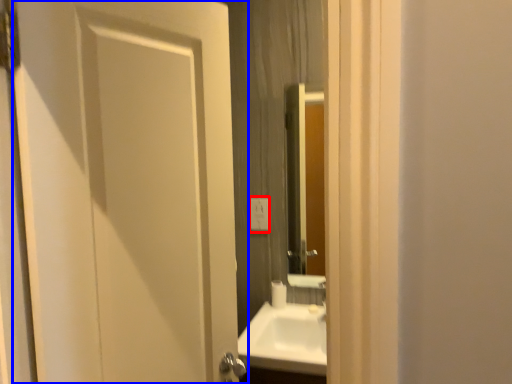
Question: Among these objects, which one is farthest to the camera, electric outlet (highlighted by a red box) or door (highlighted by a blue box)?

Choices:
 (A) electric outlet
 (B) door

Answer: (A)